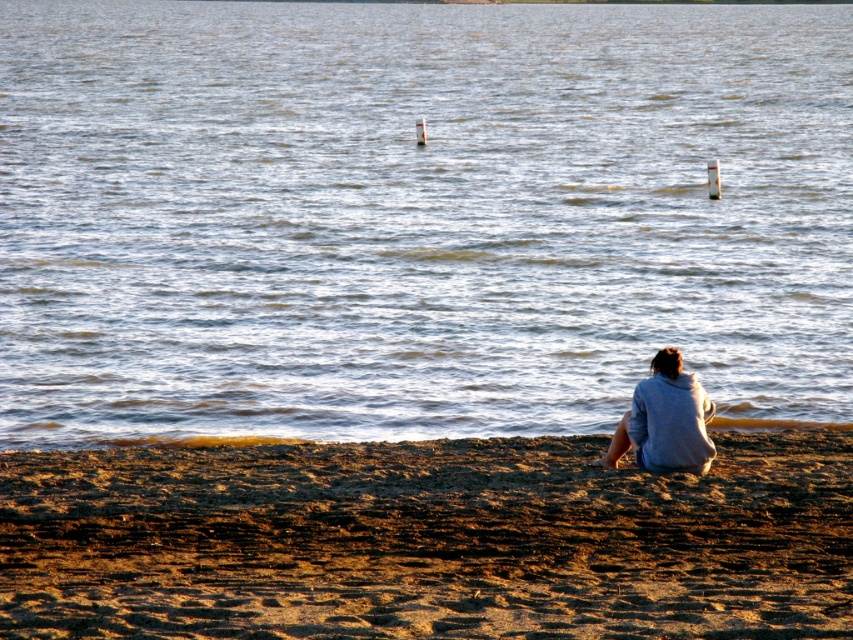
You are standing on the brown sandy beach at lower center and want to reach the gray hoodie at lower right. Which direction should you move to get closer to the hoodie?

Since the brown sandy beach at lower center is shorter than the gray hoodie at lower right, you should move forward towards the hoodie to get closer.

You are standing on the sandy beach and want to retrieve the gray hoodie at lower right. Is the clear water at center between you and the hoodie?

The clear water at center is further to the viewer than gray hoodie at lower right, so the hoodie is closer to you than the water. Therefore, the clear water at center is not between you and the gray hoodie at lower right.